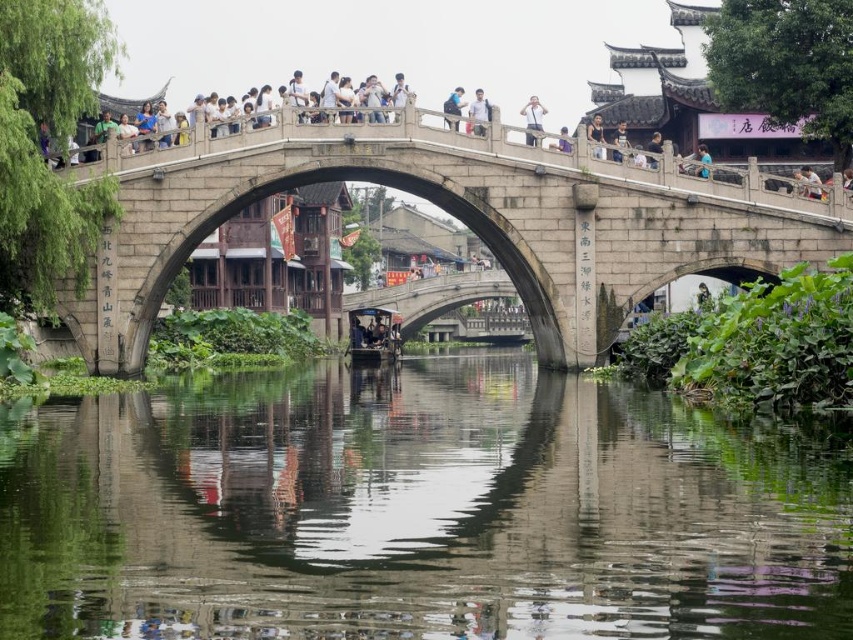
You are a photographer standing on the bridge in the traditional Chinese water town scene. You notice two light blue fabrics in your viewfinder. The first is a light blue fabric shirt at upper center, and the second is a light blue fabric at center. Which one is positioned to the left of the other?

The light blue fabric shirt at upper center is to the left of the light blue fabric at center.

You are a tourist standing on the bridge in the scene. You want to take a photo of both the light blue fabric at center and the dark blue shirt at upper center in the same frame. Can you fit both objects into your camera view without moving your position? Explain your reasoning based on their distance.

The light blue fabric at center and the dark blue shirt at upper center are 13.44 feet apart. Since the distance between them is relatively large, it may be challenging to capture both in a single frame without moving your position. However, depending on the camera lens and zoom capabilities, it might still be possible. A wider angle lens would allow you to include both objects within the camera view.